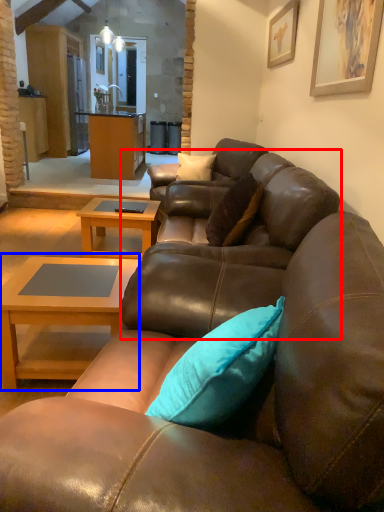
Question: Which point is closer to the camera, swivel chair (highlighted by a red box) or coffee table (highlighted by a blue box)?

Choices:
 (A) swivel chair
 (B) coffee table

Answer: (A)